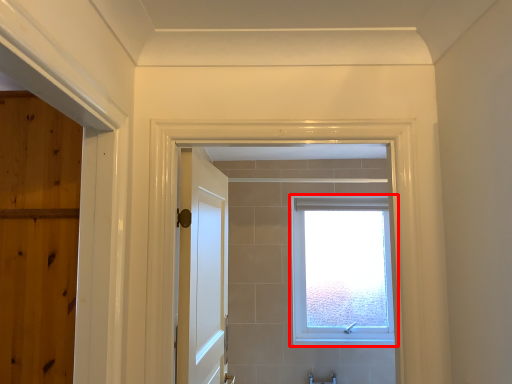
Question: Where is window (annotated by the red box) located in relation to door in the image?

Choices:
 (A) right
 (B) left

Answer: (A)